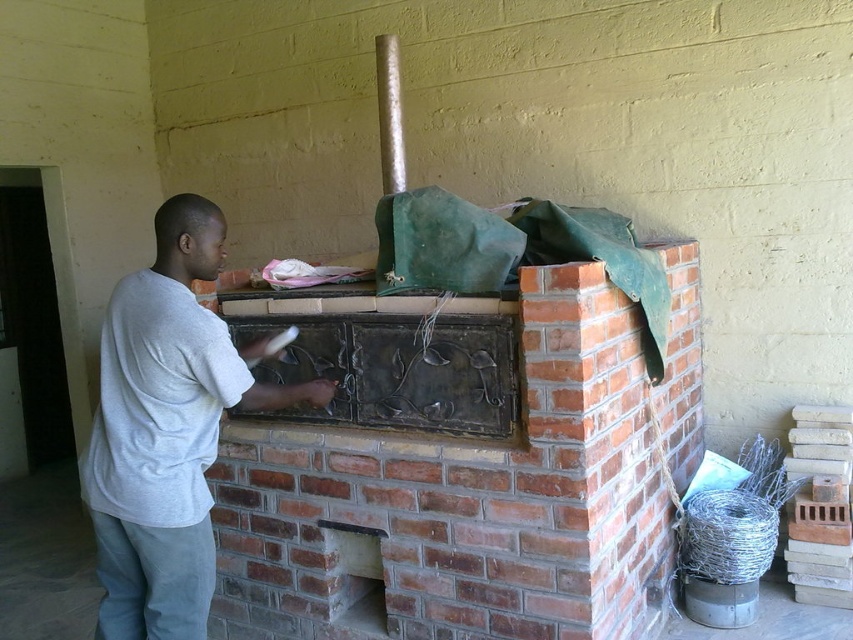
You are a visitor in this rustic kitchen and want to know if the brick fireplace at center can completely cover the gray cotton shirt at center if placed directly over it. Based on their sizes, what do you think?

The brick fireplace at center is bigger than the gray cotton shirt at center, so yes, it can completely cover the gray cotton shirt at center.

You are standing in front of the brick fireplace at center and the gray cotton shirt at center. Which object is located higher in the image?

The brick fireplace at center is positioned under the gray cotton shirt at center, so the gray cotton shirt at center is higher in the image.